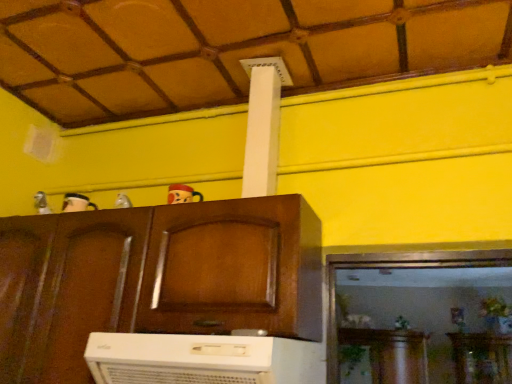
Question: Is matte plastic toy at upper center, marked as the second toy in a left-to-right arrangement, next to metallic silver toy at upper center, acting as the first toy starting from the left, and touching it?

Choices:
 (A) yes
 (B) no

Answer: (B)

Question: Could metallic silver toy at upper center, which ranks as the second toy in right-to-left order, be considered to be inside matte plastic toy at upper center, the first toy when ordered from right to left?

Choices:
 (A) no
 (B) yes

Answer: (A)

Question: Considering the relative sizes of matte plastic toy at upper center, the first toy when ordered from right to left, and metallic silver toy at upper center, which ranks as the second toy in right-to-left order, in the image provided, is matte plastic toy at upper center, the first toy when ordered from right to left, bigger than metallic silver toy at upper center, which ranks as the second toy in right-to-left order,?

Choices:
 (A) no
 (B) yes

Answer: (B)

Question: Does matte plastic toy at upper center, marked as the second toy in a left-to-right arrangement, have a lesser width compared to metallic silver toy at upper center, acting as the first toy starting from the left?

Choices:
 (A) no
 (B) yes

Answer: (A)

Question: From the image's perspective, is matte plastic toy at upper center, marked as the second toy in a left-to-right arrangement, below metallic silver toy at upper center, which ranks as the second toy in right-to-left order?

Choices:
 (A) no
 (B) yes

Answer: (A)

Question: Considering the positions of wooden cabinet at center and white plastic air conditioner at lower center in the image, is wooden cabinet at center wider or thinner than white plastic air conditioner at lower center?

Choices:
 (A) thin
 (B) wide

Answer: (A)

Question: Relative to white plastic air conditioner at lower center, is wooden cabinet at center in front or behind?

Choices:
 (A) front
 (B) behind

Answer: (B)

Question: Is wooden cabinet at center spatially inside white plastic air conditioner at lower center, or outside of it?

Choices:
 (A) outside
 (B) inside

Answer: (A)

Question: Is wooden cabinet at center bigger or smaller than white plastic air conditioner at lower center?

Choices:
 (A) small
 (B) big

Answer: (B)

Question: Is wooden cabinet at center to the left or to the right of matte plastic toy at upper center, the first toy when ordered from right to left, in the image?

Choices:
 (A) left
 (B) right

Answer: (A)

Question: Considering the positions of wooden cabinet at center and matte plastic toy at upper center, marked as the second toy in a left-to-right arrangement, in the image, is wooden cabinet at center bigger or smaller than matte plastic toy at upper center, marked as the second toy in a left-to-right arrangement,?

Choices:
 (A) small
 (B) big

Answer: (B)

Question: From their relative heights in the image, would you say wooden cabinet at center is taller or shorter than matte plastic toy at upper center, marked as the second toy in a left-to-right arrangement?

Choices:
 (A) tall
 (B) short

Answer: (A)

Question: From the image's perspective, relative to matte plastic toy at upper center, the first toy when ordered from right to left, is wooden cabinet at center above or below?

Choices:
 (A) above
 (B) below

Answer: (B)

Question: Does point (370, 51) appear closer or farther from the camera than point (122, 195)?

Choices:
 (A) farther
 (B) closer

Answer: (B)

Question: Which is correct: wooden ceiling at upper center is inside metallic silver toy at upper center, acting as the first toy starting from the left, or outside of it?

Choices:
 (A) inside
 (B) outside

Answer: (B)